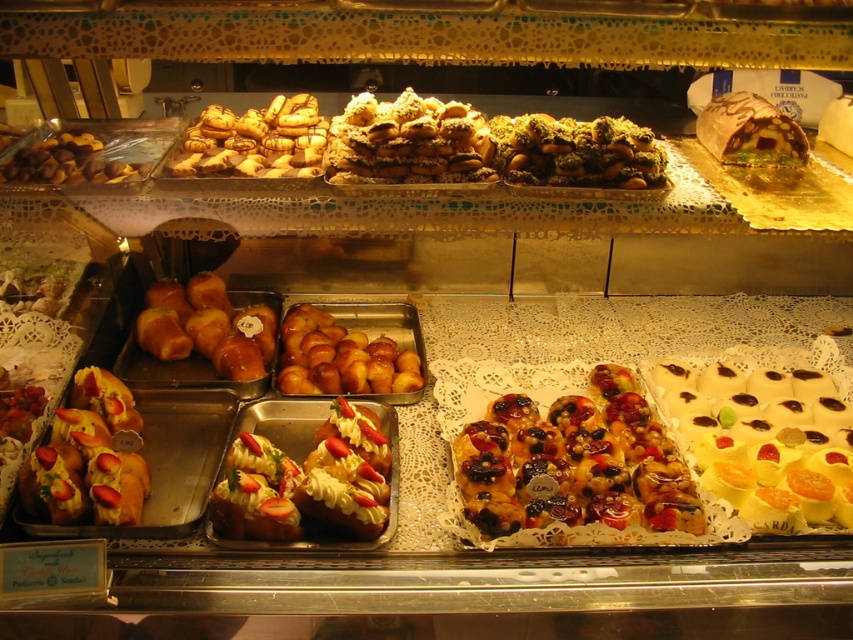
You are a customer at the bakery and want to choose a pastry that is wider between the glazed fruit pastry at center and the matte golden croissant at upper left. Which one should you choose?

The glazed fruit pastry at center might be wider than matte golden croissant at upper left, so you should choose the glazed fruit pastry at center if you want a wider pastry.

You are a customer looking at the display case and want to point out the glossy golden buns at center and the chocolate glaze cake at upper right. Which one is closer to you?

The glossy golden buns at center are closer to you than the chocolate glaze cake at upper right.